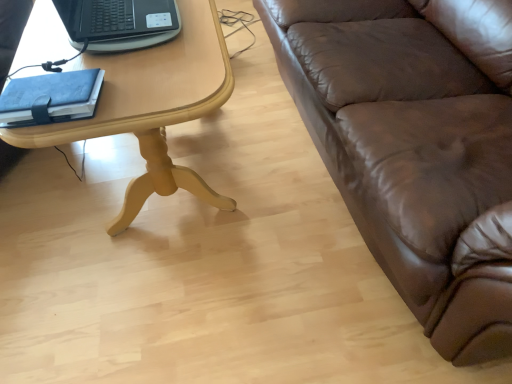
Question: Can you confirm if black plastic laptop at upper left is bigger than brown leather couch at right?

Choices:
 (A) no
 (B) yes

Answer: (A)

Question: Is black plastic laptop at upper left next to brown leather couch at right and touching it?

Choices:
 (A) yes
 (B) no

Answer: (B)

Question: Considering the relative sizes of black plastic laptop at upper left and brown leather couch at right in the image provided, is black plastic laptop at upper left taller than brown leather couch at right?

Choices:
 (A) no
 (B) yes

Answer: (A)

Question: From the image's perspective, is black plastic laptop at upper left below brown leather couch at right?

Choices:
 (A) yes
 (B) no

Answer: (A)

Question: Considering the relative sizes of black plastic laptop at upper left and brown leather couch at right in the image provided, is black plastic laptop at upper left thinner than brown leather couch at right?

Choices:
 (A) yes
 (B) no

Answer: (A)

Question: In terms of width, does light wood/yellowishmaterial/texture table at left look wider or thinner when compared to black plastic laptop at upper left?

Choices:
 (A) wide
 (B) thin

Answer: (A)

Question: Is light wood/yellowishmaterial/texture table at left taller or shorter than black plastic laptop at upper left?

Choices:
 (A) tall
 (B) short

Answer: (A)

Question: From the image's perspective, is light wood/yellowishmaterial/texture table at left above or below black plastic laptop at upper left?

Choices:
 (A) below
 (B) above

Answer: (A)

Question: Do you think light wood/yellowishmaterial/texture table at left is within black plastic laptop at upper left, or outside of it?

Choices:
 (A) inside
 (B) outside

Answer: (B)

Question: Based on their positions, is blue leather notebook at left located to the left or right of brown leather couch at right?

Choices:
 (A) right
 (B) left

Answer: (B)

Question: From their relative heights in the image, would you say blue leather notebook at left is taller or shorter than brown leather couch at right?

Choices:
 (A) tall
 (B) short

Answer: (B)

Question: Considering their positions, is blue leather notebook at left located in front of or behind brown leather couch at right?

Choices:
 (A) behind
 (B) front

Answer: (A)

Question: From the image's perspective, is blue leather notebook at left located above or below brown leather couch at right?

Choices:
 (A) above
 (B) below

Answer: (B)

Question: From the image's perspective, relative to black plastic laptop at upper left, is brown leather couch at right above or below?

Choices:
 (A) above
 (B) below

Answer: (A)

Question: Considering the positions of brown leather couch at right and black plastic laptop at upper left in the image, is brown leather couch at right bigger or smaller than black plastic laptop at upper left?

Choices:
 (A) small
 (B) big

Answer: (B)